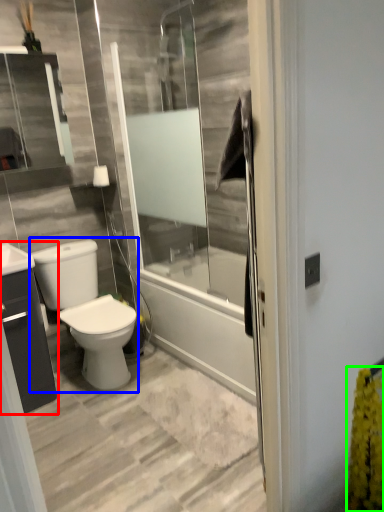
Question: Estimate the real-world distances between objects in this image. Which object is closer to bathroom cabinet (highlighted by a red box), gray (highlighted by a blue box) or flower (highlighted by a green box)?

Choices:
 (A) gray
 (B) flower

Answer: (A)